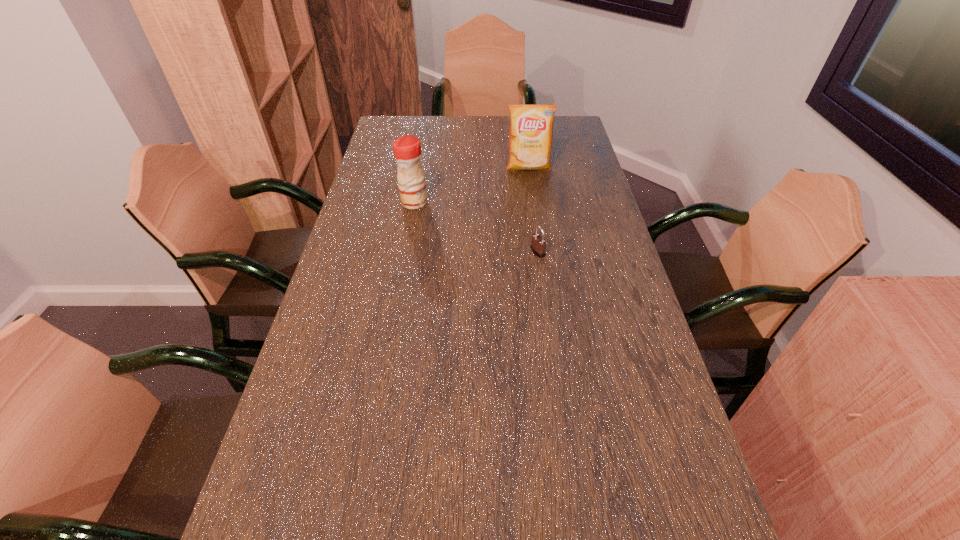
The width and height of the screenshot is (960, 540). I want to click on empty space between the crisp (potato chip) and the condiment, so click(471, 185).

The image size is (960, 540). Find the location of `vacant space that's between the leftmost object and the crisp (potato chip)`. vacant space that's between the leftmost object and the crisp (potato chip) is located at coordinates (471, 185).

Locate an element on the screen. The width and height of the screenshot is (960, 540). unoccupied position between the padlock and the farthest object is located at coordinates (533, 210).

What are the coordinates of `unoccupied position between the leftmost object and the farthest object` in the screenshot? It's located at (471, 185).

Identify which object is located as the second nearest to the second nearest object. Please provide its 2D coordinates. Your answer should be formatted as a tuple, i.e. [(x, y)], where the tuple contains the x and y coordinates of a point satisfying the conditions above.

[(538, 244)]

Locate an element on the screen. object that is the closest to the padlock is located at coordinates (407, 149).

Find the location of a particular element. This screenshot has width=960, height=540. free region that satisfies the following two spatial constraints: 1. on the front side of the leftmost object; 2. on the left side of the padlock is located at coordinates (405, 252).

At what (x,y) coordinates should I click in order to perform the action: click on free space in the image that satisfies the following two spatial constraints: 1. on the front side of the nearest object; 2. on the left side of the second nearest object. Please return your answer as a coordinate pair (x, y). The image size is (960, 540). Looking at the image, I should click on (405, 252).

In order to click on vacant space that satisfies the following two spatial constraints: 1. on the front side of the leftmost object; 2. on the right side of the padlock in this screenshot , I will do (405, 252).